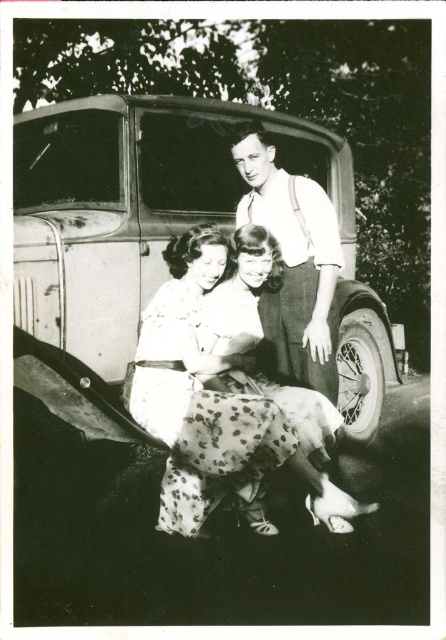
Consider the image. How far apart are metallic vintage car at center and floral-patterned dress at center?

metallic vintage car at center is 23.48 inches from floral-patterned dress at center.

What do you see at coordinates (161, 237) in the screenshot? This screenshot has width=446, height=640. I see `metallic vintage car at center` at bounding box center [161, 237].

I want to click on metallic vintage car at center, so click(161, 237).

What do you see at coordinates (161, 237) in the screenshot?
I see `metallic vintage car at center` at bounding box center [161, 237].

Looking at this image, does metallic vintage car at center come behind white cotton shirt at upper center?

No, it is not.

This screenshot has height=640, width=446. In order to click on metallic vintage car at center in this screenshot , I will do `click(161, 237)`.

Find the location of `floral-patterned dress at center`. floral-patterned dress at center is located at coordinates (201, 397).

Does floral-patterned dress at center come in front of dotted fabric skirt at center?

Yes.

Locate an element on the screen. The height and width of the screenshot is (640, 446). floral-patterned dress at center is located at coordinates (201, 397).